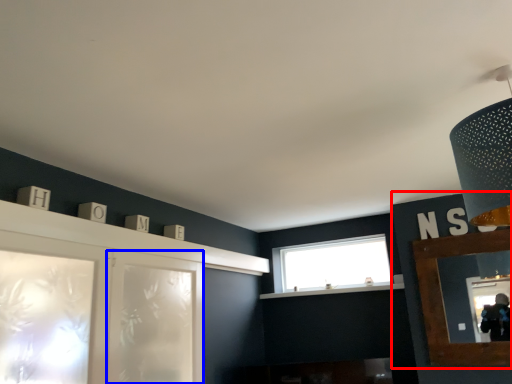
Question: Among these objects, which one is nearest to the camera, cabinetry (highlighted by a red box) or screen door (highlighted by a blue box)?

Choices:
 (A) cabinetry
 (B) screen door

Answer: (B)